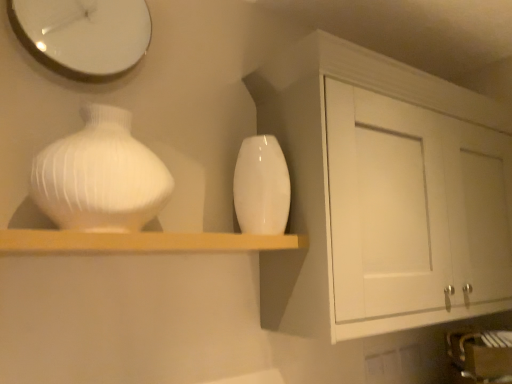
Question: Is wooden shelf at center positioned in front of glossy ceramic vase at center, which ranks as the 1th vase in right-to-left order?

Choices:
 (A) no
 (B) yes

Answer: (B)

Question: Considering the relative sizes of wooden shelf at center and glossy ceramic vase at center, the second vase when ordered from left to right, in the image provided, is wooden shelf at center bigger than glossy ceramic vase at center, the second vase when ordered from left to right,?

Choices:
 (A) yes
 (B) no

Answer: (A)

Question: Is wooden shelf at center not inside glossy ceramic vase at center, the second vase when ordered from left to right?

Choices:
 (A) no
 (B) yes

Answer: (B)

Question: From a real-world perspective, is wooden shelf at center physically above glossy ceramic vase at center, the second vase when ordered from left to right?

Choices:
 (A) yes
 (B) no

Answer: (B)

Question: Does wooden shelf at center have a greater width compared to glossy ceramic vase at center, the second vase positioned from the front?

Choices:
 (A) no
 (B) yes

Answer: (B)

Question: Is wooden shelf at center to the right of glossy ceramic vase at center, the second vase when ordered from left to right, from the viewer's perspective?

Choices:
 (A) yes
 (B) no

Answer: (B)

Question: Can you confirm if wooden shelf at center is thinner than white matte cabinet at upper right?

Choices:
 (A) no
 (B) yes

Answer: (B)

Question: Is there a large distance between wooden shelf at center and white matte cabinet at upper right?

Choices:
 (A) yes
 (B) no

Answer: (B)

Question: Does wooden shelf at center turn towards white matte cabinet at upper right?

Choices:
 (A) no
 (B) yes

Answer: (A)

Question: Is wooden shelf at center wider than white matte cabinet at upper right?

Choices:
 (A) no
 (B) yes

Answer: (A)

Question: From the image's perspective, is wooden shelf at center under white matte cabinet at upper right?

Choices:
 (A) yes
 (B) no

Answer: (A)

Question: Does wooden shelf at center have a smaller size compared to white matte cabinet at upper right?

Choices:
 (A) yes
 (B) no

Answer: (A)

Question: Is white glossy clock at upper left to the left of glossy ceramic vase at center, which ranks as the 1th vase in right-to-left order, from the viewer's perspective?

Choices:
 (A) yes
 (B) no

Answer: (A)